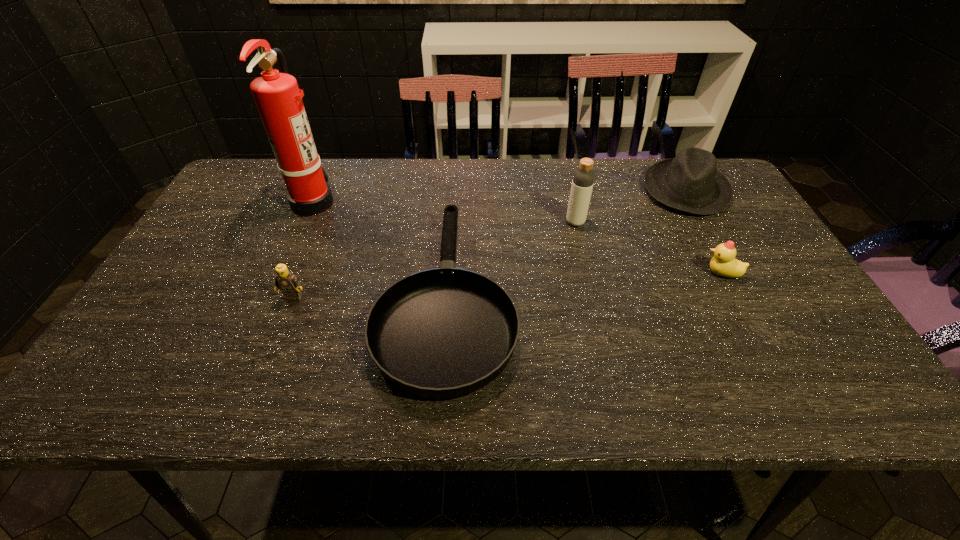
Locate an element on the screen. The image size is (960, 540). vacant space situated 0.300m on the front of the fedora is located at coordinates (747, 300).

The image size is (960, 540). In order to click on vacant area located in front of the Lego in this screenshot , I will do coord(278,336).

At what (x,y) coordinates should I click in order to perform the action: click on free space located 0.210m on the front-facing side of the duckling. Please return your answer as a coordinate pair (x, y). Looking at the image, I should click on (618, 273).

Where is `vacant space located 0.060m on the front-facing side of the duckling`? This screenshot has width=960, height=540. vacant space located 0.060m on the front-facing side of the duckling is located at coordinates (679, 273).

I want to click on vacant space located on the front-facing side of the duckling, so click(662, 273).

Where is `vacant region located at the end of the handle of the frying pan`? This screenshot has width=960, height=540. vacant region located at the end of the handle of the frying pan is located at coordinates (455, 191).

Identify the location of free spot located at the end of the handle of the frying pan. (455, 178).

I want to click on vacant space located 0.200m at the end of the handle of the frying pan, so click(455, 181).

In order to click on fire extinguisher located in the far edge section of the desktop in this screenshot , I will do `click(278, 98)`.

Find the location of `fedora that is at the far edge`. fedora that is at the far edge is located at coordinates (690, 182).